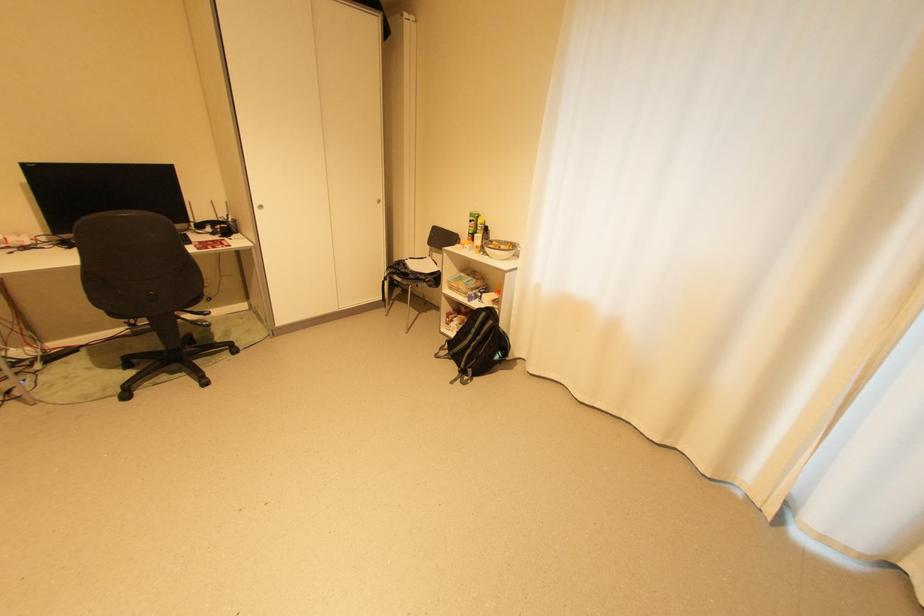
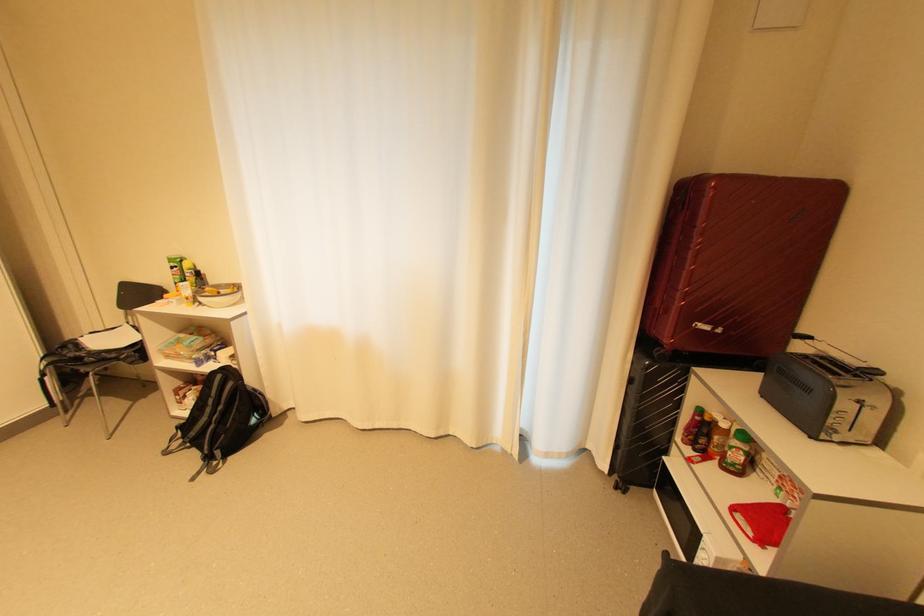
Find the pixel in the second image that matches the point at 477,233 in the first image.

(185, 284)